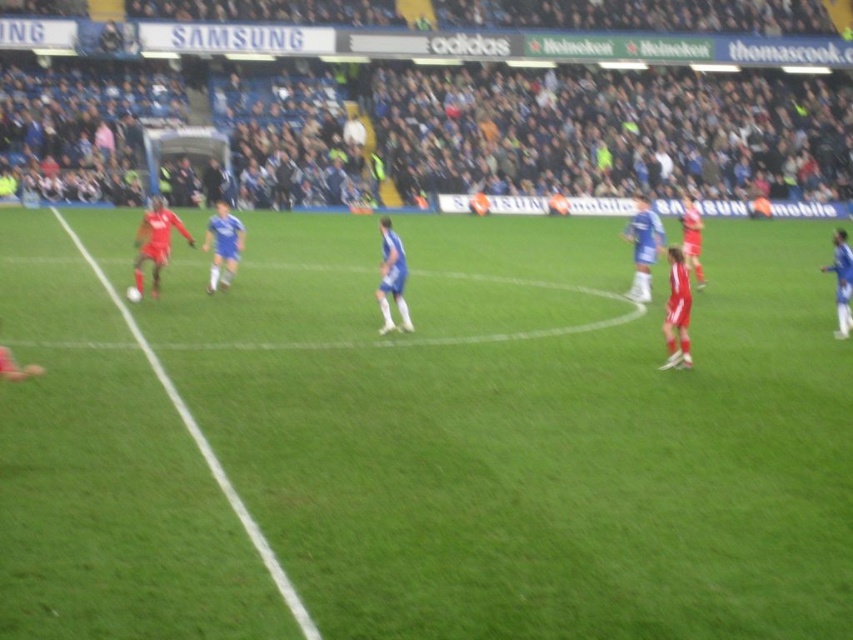
Where is the green grass field at center located in the image?

The green grass field at center is located at point (x=421, y=436) in the image.

You are a drone operator trying to capture the soccer match from above. The stadium has a restricted airspace zone that extends up to 100 meters above the green grass field at center. If your drone is currently flying at 120 meters altitude, how far above the restricted zone are you?

The restricted airspace zone extends up to 100 meters above the green grass field at center. Since your drone is flying at 120 meters altitude, it is 20 meters above the restricted zone.

You are a soccer player standing on the green grass at left and want to pass the ball to a teammate on the green grass field at center. Which direction should you pass the ball to reach your teammate?

The green grass field at center is positioned on the right side of green grass at left, so you should pass the ball to the right to reach your teammate.